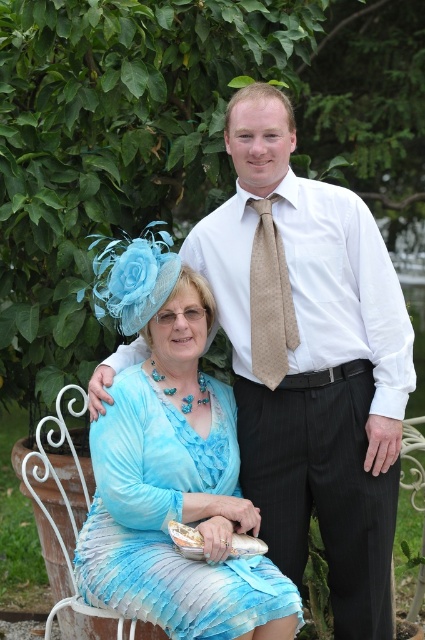
Question: Is white shirt at center to the right of beige dotted tie at center from the viewer's perspective?

Choices:
 (A) yes
 (B) no

Answer: (A)

Question: Does light blue chiffon dress at lower left have a lesser width compared to beige dotted tie at center?

Choices:
 (A) yes
 (B) no

Answer: (B)

Question: Estimate the real-world distances between objects in this image. Which object is farther from the beige dotted tie at center?

Choices:
 (A) light blue chiffon dress at lower left
 (B) white shirt at center

Answer: (A)

Question: Which point is farther to the camera?

Choices:
 (A) (115, 410)
 (B) (212, 218)
 (C) (257, 280)

Answer: (B)

Question: Which point is closer to the camera taking this photo?

Choices:
 (A) (269, 260)
 (B) (166, 596)

Answer: (B)

Question: Can you confirm if light blue chiffon dress at lower left is positioned to the left of beige dotted tie at center?

Choices:
 (A) yes
 (B) no

Answer: (A)